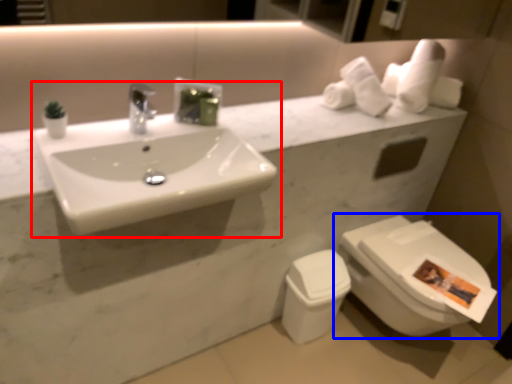
Question: Which point is closer to the camera, sink (highlighted by a red box) or toilet (highlighted by a blue box)?

Choices:
 (A) sink
 (B) toilet

Answer: (A)